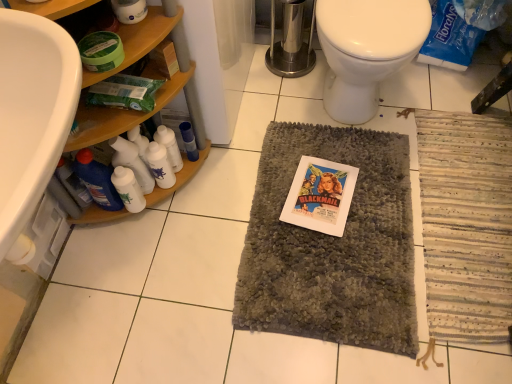
Identify the location of vacant point to the right of white glossy bottles at left, which is the 3th bottle from right to left. This screenshot has width=512, height=384. (216, 186).